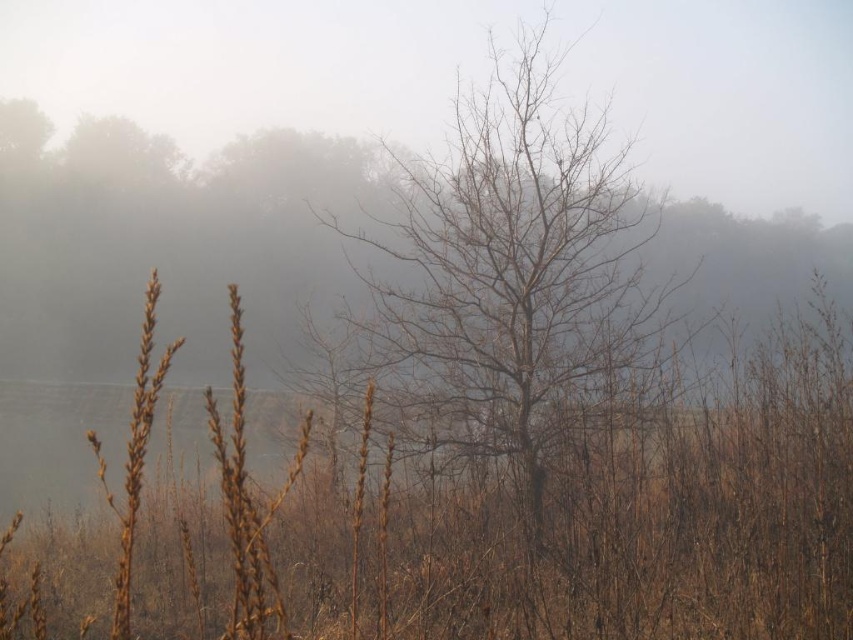
Does brown dry grass at center appear over bare branches at center?

Incorrect, brown dry grass at center is not positioned above bare branches at center.

Is brown dry grass at center thinner than bare branches at center?

No.

At what (x,y) coordinates should I click in order to perform the action: click on brown dry grass at center. Please return your answer as a coordinate pair (x, y). This screenshot has height=640, width=853. Looking at the image, I should click on [x=555, y=529].